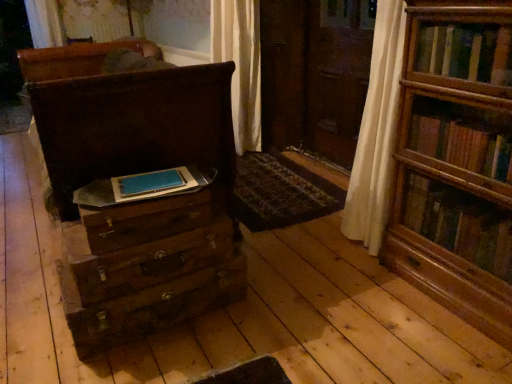
Question: Is wooden bookshelf at right taller or shorter than blue matte paper at center?

Choices:
 (A) short
 (B) tall

Answer: (B)

Question: Is wooden bookshelf at right in front of or behind blue matte paper at center in the image?

Choices:
 (A) behind
 (B) front

Answer: (B)

Question: Estimate the real-world distances between objects in this image. Which object is farther from the patterned carpet at center?

Choices:
 (A) blue matte paper at center
 (B) matte brown chest of drawers at left
 (C) wooden drawer at lower left, the 1th drawer when ordered from top to bottom
 (D) wooden drawer at center, the second drawer positioned from the top
 (E) wooden drawer at center, the 1th drawer in the bottom-to-top sequence

Answer: (A)

Question: Estimate the real-world distances between objects in this image. Which object is closer to the wooden drawer at center, marked as the third drawer in a top-to-bottom arrangement?

Choices:
 (A) blue matte paper at center
 (B) matte brown chest of drawers at left
 (C) wooden bookshelf at right
 (D) patterned carpet at center
 (E) wooden drawer at center, the second drawer positioned from the top

Answer: (E)